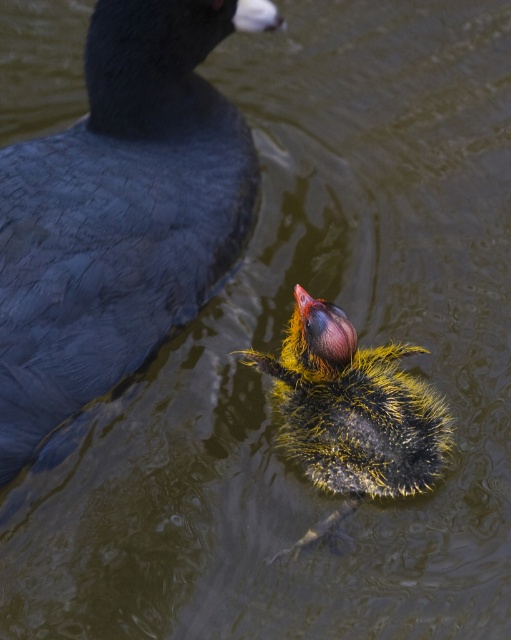
Question: Can you confirm if dark blue feathers at upper left is positioned below yellow downy feather at center?

Choices:
 (A) no
 (B) yes

Answer: (A)

Question: Is dark blue feathers at upper left further to camera compared to yellow downy feather at center?

Choices:
 (A) no
 (B) yes

Answer: (A)

Question: Which of the following is the closest to the observer?

Choices:
 (A) dark blue feathers at upper left
 (B) yellow downy feather at center

Answer: (A)

Question: Can you confirm if dark blue feathers at upper left is positioned to the right of yellow downy feather at center?

Choices:
 (A) yes
 (B) no

Answer: (B)